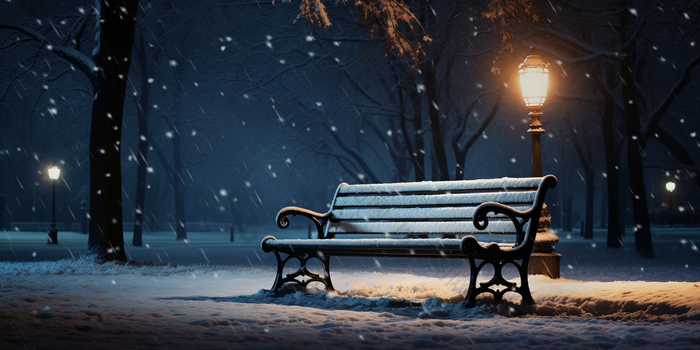
I want to click on light bulb, so click(540, 79).